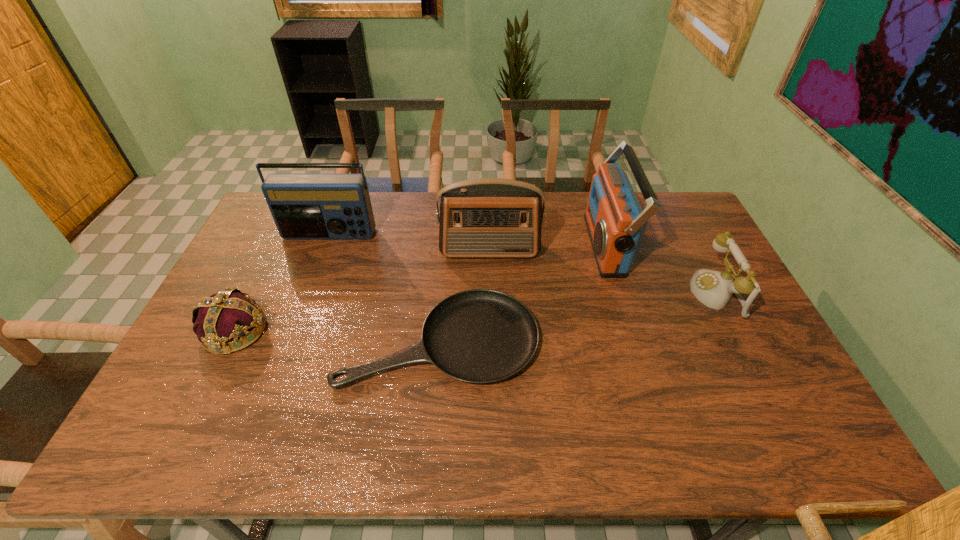
Locate an element on the screen. The width and height of the screenshot is (960, 540). vacant space located 0.330m on the front-facing side of the second radio receiver from right to left is located at coordinates pyautogui.click(x=492, y=343).

Where is `vacant area located on the dial of the telephone`? vacant area located on the dial of the telephone is located at coordinates (600, 294).

Identify the location of vacant area situated on the dial of the telephone. The image size is (960, 540). (580, 294).

At what (x,y) coordinates should I click in order to perform the action: click on vacant space located 0.170m on the dial of the telephone. Please return your answer as a coordinate pair (x, y). Looking at the image, I should click on (x=636, y=294).

Locate an element on the screen. Image resolution: width=960 pixels, height=540 pixels. free location located 0.050m on the back of the crown is located at coordinates (254, 294).

Locate an element on the screen. The height and width of the screenshot is (540, 960). free space located 0.120m on the right of the frying pan is located at coordinates (582, 340).

You are a GUI agent. You are given a task and a screenshot of the screen. Output one action in this format:
    pyautogui.click(x=<x>, y=<y>)
    Task: Click on the radio receiver that is at the left edge
    The width and height of the screenshot is (960, 540).
    Given the screenshot: What is the action you would take?
    pyautogui.click(x=304, y=206)

At what (x,y) coordinates should I click in order to perform the action: click on crown located at the left edge. Please return your answer as a coordinate pair (x, y). The image size is (960, 540). Looking at the image, I should click on (223, 317).

Locate an element on the screen. The width and height of the screenshot is (960, 540). object that is at the right edge is located at coordinates (714, 289).

Where is `object located at the far left corner`? This screenshot has height=540, width=960. object located at the far left corner is located at coordinates (304, 206).